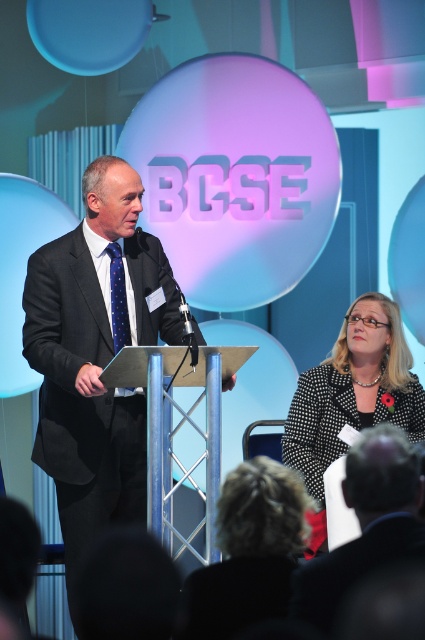
From the picture: You are an event planner who needs to ensure all speakers are visible to the audience. Given the black suit at center and the blue dotted tie at left, which one is more likely to be seen clearly by the audience from the back of the room?

The black suit at center is taller than the blue dotted tie at left, so the black suit at center will be more visible from the back of the room.

You are an event photographer and need to capture a photo of the speaker wearing the dark gray suit at center and the blue dotted tie at left. Based on their positions, which item should you focus on first to ensure both are in frame?

The blue dotted tie at left should be focused on first since the dark gray suit at center is to the right of it, ensuring both will be in frame when starting from the left side.